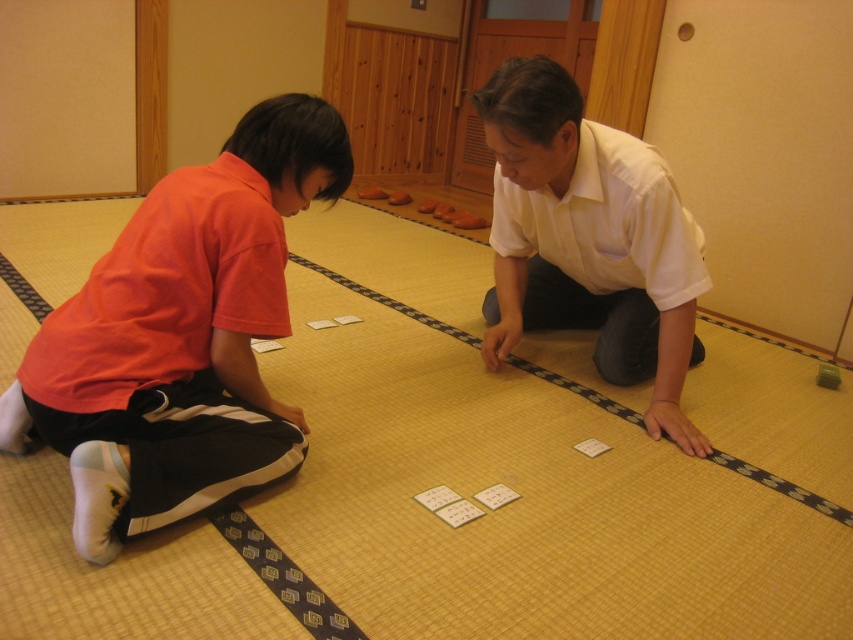
Question: Which point is farther to the camera?

Choices:
 (A) orange fabric shirt at left
 (B) white matte shirt at center

Answer: (B)

Question: Does orange fabric shirt at left have a lesser width compared to white matte shirt at center?

Choices:
 (A) yes
 (B) no

Answer: (A)

Question: Can you confirm if orange fabric shirt at left is wider than white matte shirt at center?

Choices:
 (A) no
 (B) yes

Answer: (A)

Question: Observing the image, what is the correct spatial positioning of orange fabric shirt at left in reference to white matte shirt at center?

Choices:
 (A) right
 (B) left

Answer: (B)

Question: Which of the following is the farthest from the observer?

Choices:
 (A) (512, 88)
 (B) (167, 426)

Answer: (A)